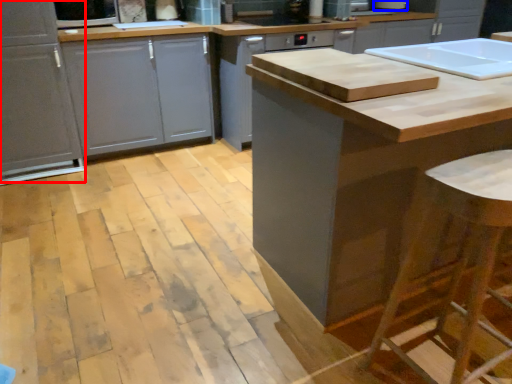
Question: Which of the following is the farthest to the observer, cabinetry (highlighted by a red box) or appliance (highlighted by a blue box)?

Choices:
 (A) cabinetry
 (B) appliance

Answer: (B)